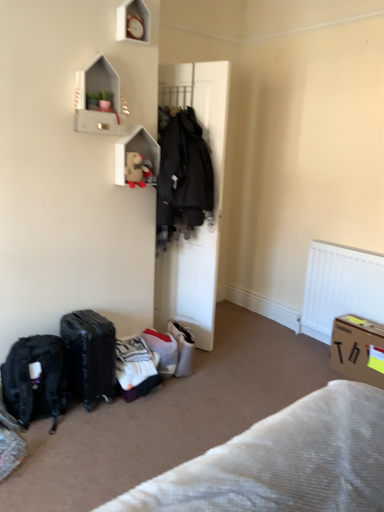
Locate an element on the screen. The width and height of the screenshot is (384, 512). vacant space in between white matte door at center and cardboard box at lower right is located at coordinates (266, 359).